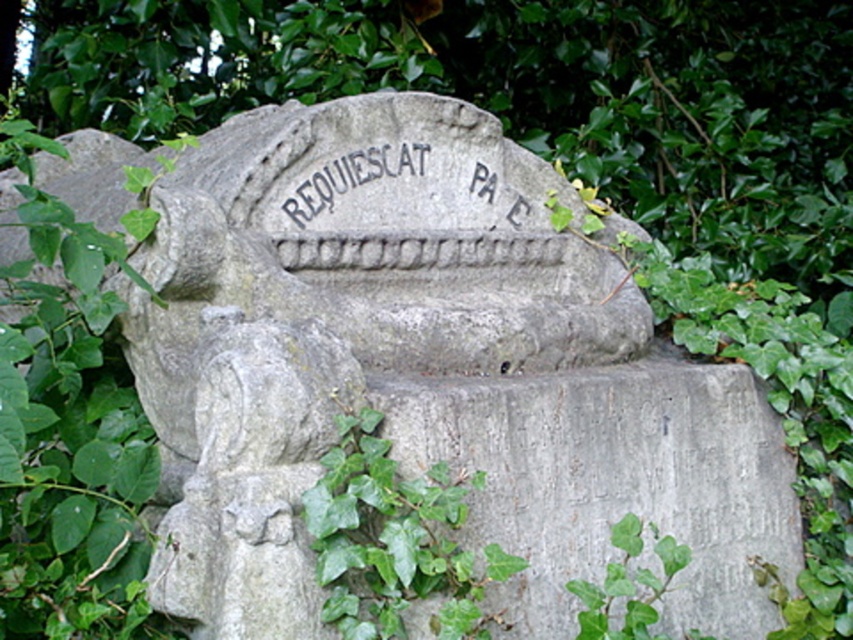
Can you confirm if green leafy ivy at lower center is wider than green leafy ivy at lower right?

Yes, green leafy ivy at lower center is wider than green leafy ivy at lower right.

Is green leafy ivy at lower center below green leafy ivy at lower right?

Incorrect, green leafy ivy at lower center is not positioned below green leafy ivy at lower right.

This screenshot has height=640, width=853. In order to click on green leafy ivy at lower center in this screenshot , I will do `click(395, 540)`.

Who is lower down, green leafy ivy at lower center or black stone inscription at center?

green leafy ivy at lower center is lower down.

Does point (439, 504) come closer to viewer compared to point (343, 176)?

Yes, point (439, 504) is closer to viewer.

Is point (450, 500) in front of point (306, 196)?

Yes, it is in front of point (306, 196).

I want to click on green leafy ivy at lower center, so click(395, 540).

Measure the distance between green leafy ivy at lower right and black stone inscription at center.

Result: 87.61 centimeters

Based on the photo, can you confirm if green leafy ivy at lower right is taller than black stone inscription at center?

Yes, green leafy ivy at lower right is taller than black stone inscription at center.

Is point (590, 608) farther from camera compared to point (372, 154)?

No, (590, 608) is in front of (372, 154).

Locate an element on the screen. The width and height of the screenshot is (853, 640). green leafy ivy at lower right is located at coordinates pos(628,586).